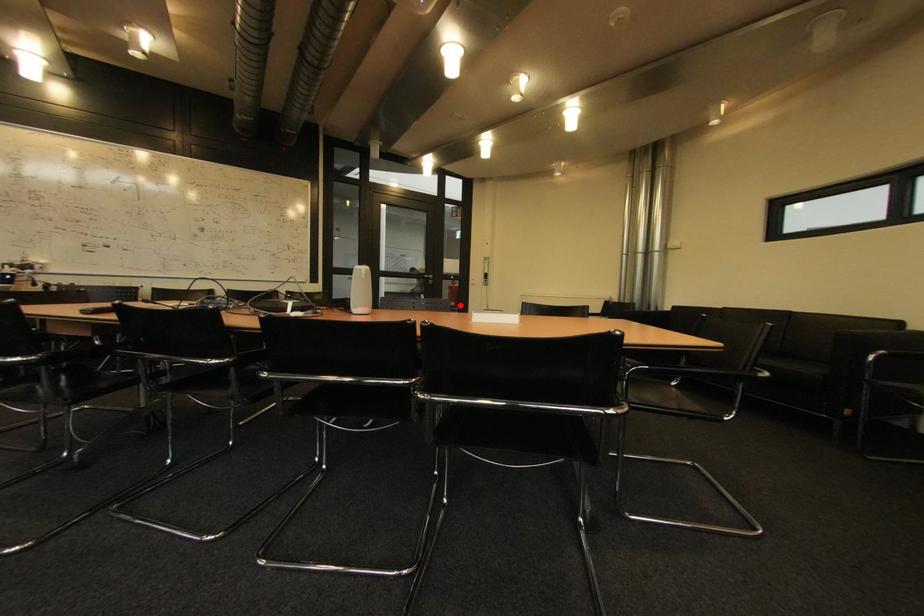
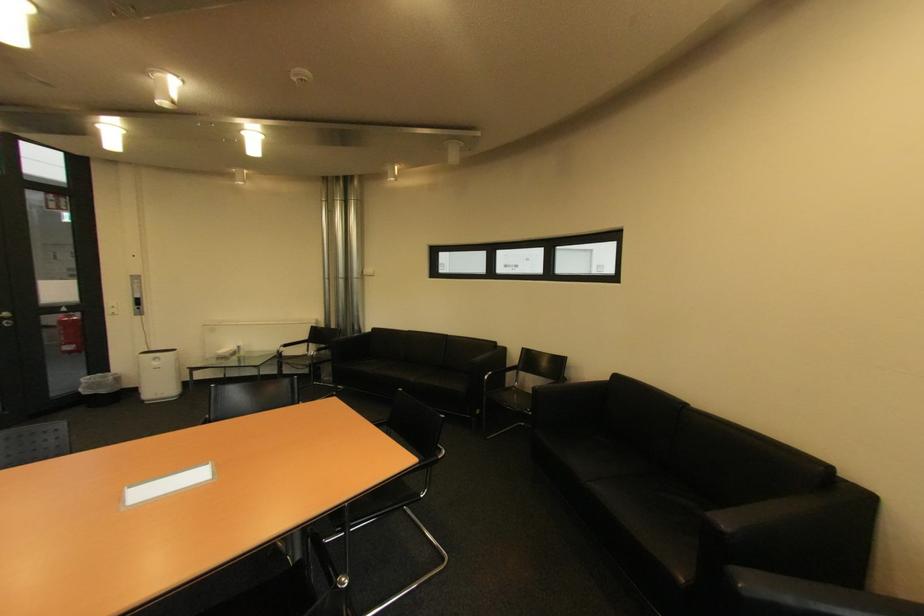
Question: A red point is marked in image1. In image2, is the corresponding 3D point closer to the camera or farther? Reply with the corresponding letter.

Choices:
 (A) The corresponding 3D point is closer.
 (B) The corresponding 3D point is farther.

Answer: (A)